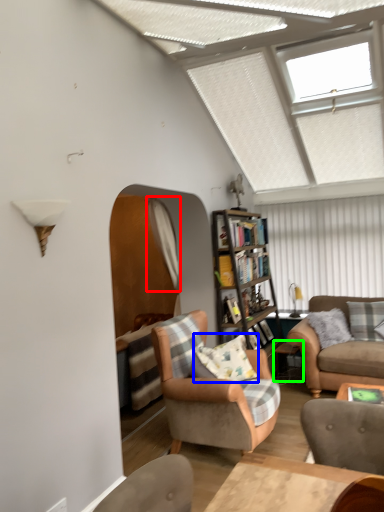
Question: Estimate the real-world distances between objects in this image. Which object is closer to curtain (highlighted by a red box), pillow (highlighted by a blue box) or side table (highlighted by a green box)?

Choices:
 (A) pillow
 (B) side table

Answer: (A)